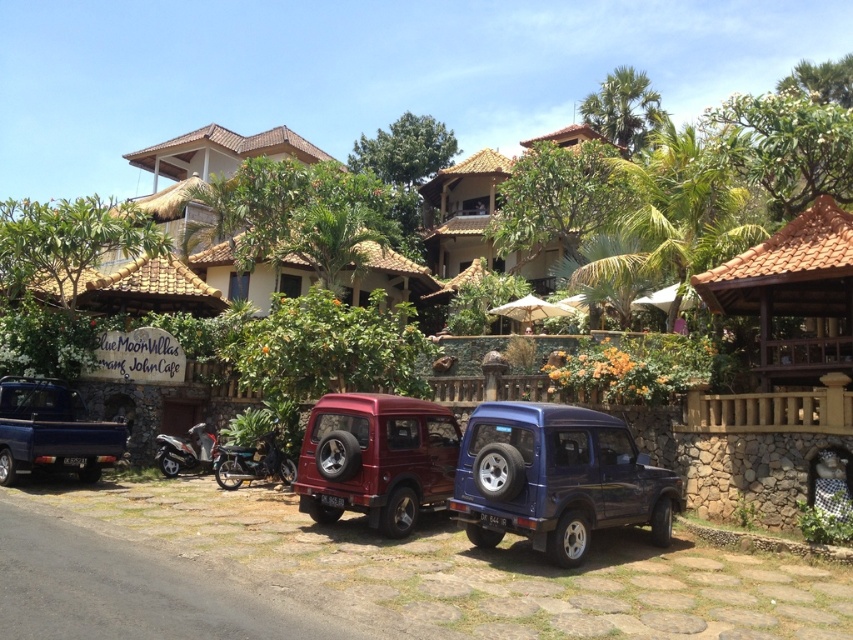
Which is more to the left, metallic red suv at center or metallic silver scooter at lower left?

metallic silver scooter at lower left is more to the left.

Which of these two, metallic red suv at center or metallic silver scooter at lower left, stands taller?

Standing taller between the two is metallic red suv at center.

Between point (314, 408) and point (196, 436), which one is positioned behind?

The point (196, 436) is behind.

Identify the location of metallic red suv at center. Image resolution: width=853 pixels, height=640 pixels. (376, 460).

Who is lower down, matte black truck at left or metallic silver scooter at lower left?

metallic silver scooter at lower left is below.

Does matte black truck at left appear over metallic silver scooter at lower left?

Correct, matte black truck at left is located above metallic silver scooter at lower left.

Identify the location of matte black truck at left. The height and width of the screenshot is (640, 853). (51, 432).

Is metallic blue suv at center shorter than matte black truck at left?

In fact, metallic blue suv at center may be taller than matte black truck at left.

Does metallic blue suv at center appear on the left side of matte black truck at left?

Incorrect, metallic blue suv at center is not on the left side of matte black truck at left.

Between point (624, 474) and point (20, 451), which one is positioned behind?

Point (20, 451)

I want to click on metallic blue suv at center, so coord(556,477).